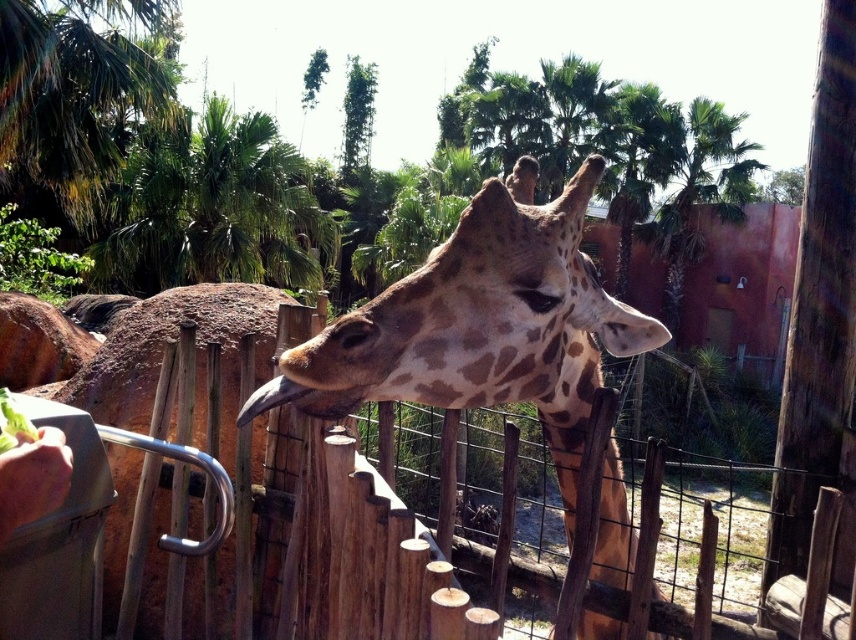
You are a zookeeper who needs to ensure the safety of both the giraffe and visitors. Given the spotted brown giraffe at center and the brown matte beak at center, which object is taller and requires more vertical space in the enclosure?

The spotted brown giraffe at center is taller than the brown matte beak at center, so it requires more vertical space in the enclosure.

You are a zookeeper standing in the giraffe enclosure. You need to place a new feeding station between the spotted brown giraffe at center and the green leafy palm tree at upper center. Based on their positions, which side of the palm tree should the feeding station be placed on?

The spotted brown giraffe at center is positioned on the right side of the green leafy palm tree at upper center, so the feeding station should be placed to the right of the palm tree to be between them.

You are standing in front of the giraffe enclosure at the zoo. There is a point marked at coordinates (x=214, y=205). What object is located at that point?

The point at coordinates (x=214, y=205) marks a green leafy palm tree at upper center.